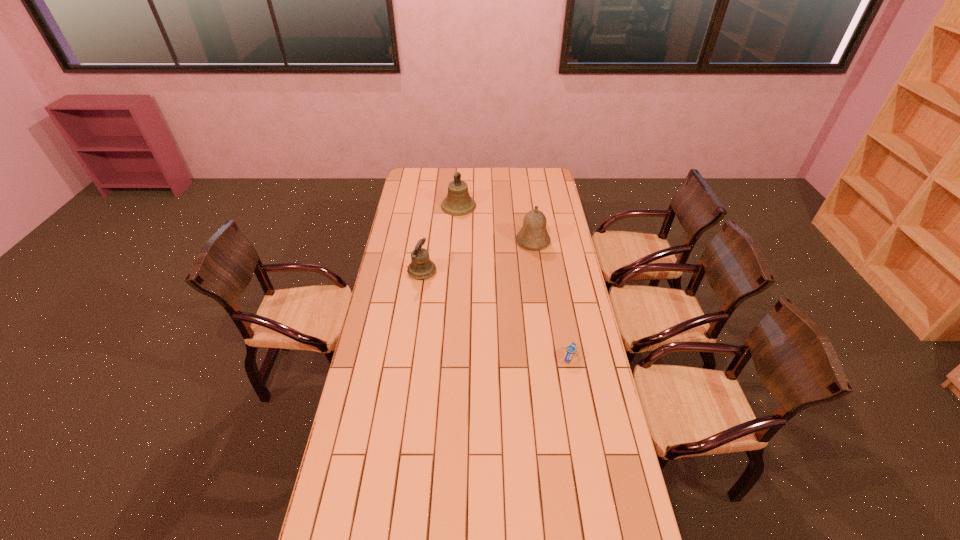
Find the location of a particular element. free region located on the front of the nearest object is located at coordinates (585, 441).

What are the coordinates of `object that is at the left edge` in the screenshot? It's located at (421, 267).

This screenshot has width=960, height=540. In order to click on bell that is positioned at the right edge in this screenshot , I will do point(533,235).

The height and width of the screenshot is (540, 960). Identify the location of watch that is at the right edge. pyautogui.click(x=570, y=349).

In order to click on vacant space at the far edge in this screenshot , I will do `click(471, 173)`.

Where is `vacant space at the left edge`? The image size is (960, 540). vacant space at the left edge is located at coordinates (395, 256).

This screenshot has width=960, height=540. I want to click on vacant space at the right edge of the desktop, so click(x=565, y=224).

I want to click on free space that is in between the watch and the farthest object, so click(514, 281).

Identify the location of vacant area that lies between the shortest bell and the second farthest object. The image size is (960, 540). (477, 256).

You are a GUI agent. You are given a task and a screenshot of the screen. Output one action in this format:
    pyautogui.click(x=<x>, y=<y>)
    Task: Click on the free point between the farthest object and the rightmost bell
    
    Given the screenshot: What is the action you would take?
    pyautogui.click(x=495, y=224)